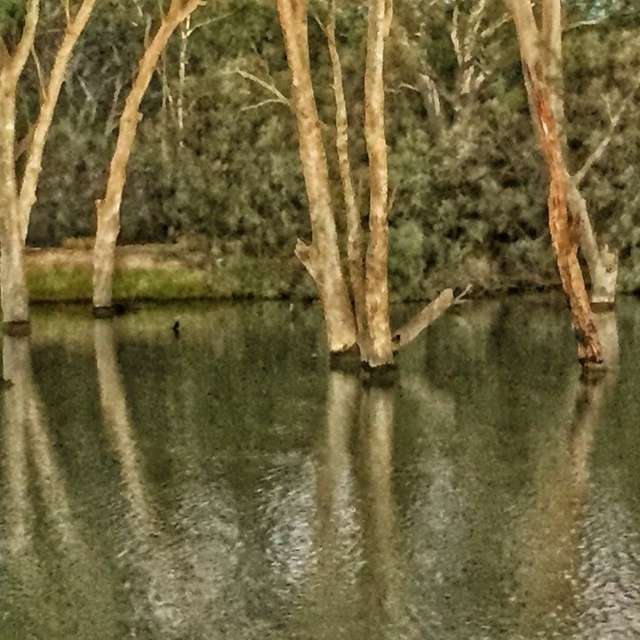
Question: Considering the relative positions of greenish reflective water at center and brown rough bark tree at center in the image provided, where is greenish reflective water at center located with respect to brown rough bark tree at center?

Choices:
 (A) right
 (B) left

Answer: (B)

Question: Which of the following is the closest to the observer?

Choices:
 (A) (449, 515)
 (B) (177, 182)

Answer: (A)

Question: Among these objects, which one is farthest from the camera?

Choices:
 (A) greenish reflective water at center
 (B) brown rough bark tree at center

Answer: (B)

Question: Does greenish reflective water at center have a smaller size compared to brown rough bark tree at center?

Choices:
 (A) yes
 (B) no

Answer: (A)

Question: Which of the following is the closest to the observer?

Choices:
 (A) greenish reflective water at center
 (B) brown rough bark tree at center

Answer: (A)

Question: Does greenish reflective water at center appear on the left side of brown rough bark tree at center?

Choices:
 (A) yes
 (B) no

Answer: (A)